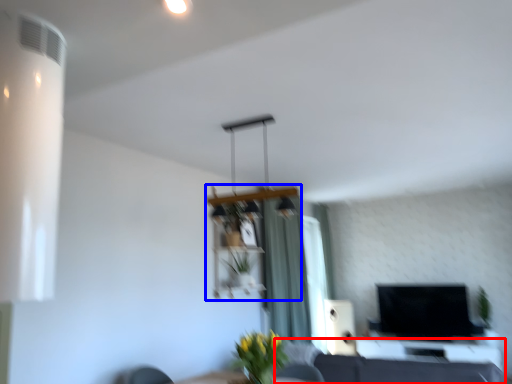
Question: Among these objects, which one is nearest to the camera, couch (highlighted by a red box) or shelf (highlighted by a blue box)?

Choices:
 (A) couch
 (B) shelf

Answer: (A)